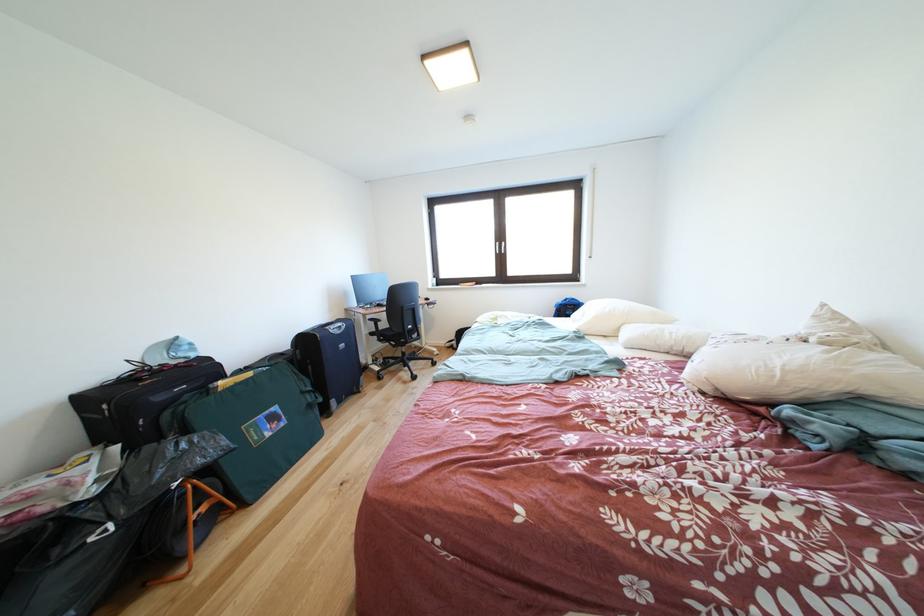
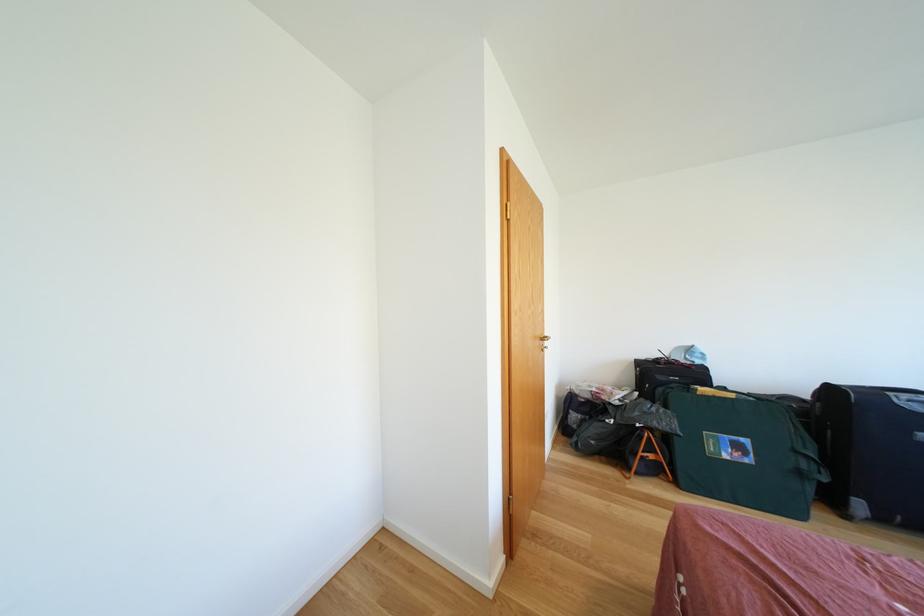
In the second image, find the point that corresponds to pixel 259 379 in the first image.

(739, 400)